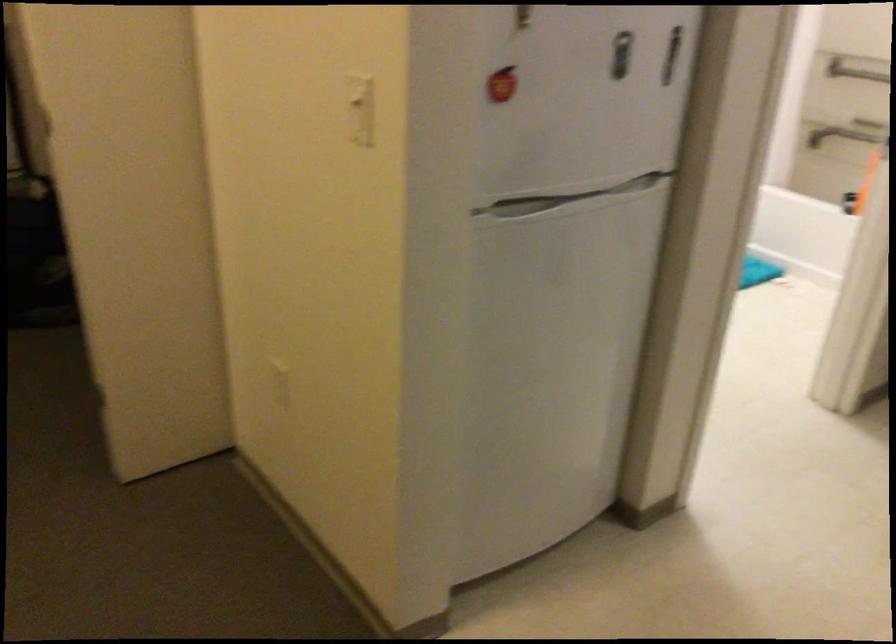
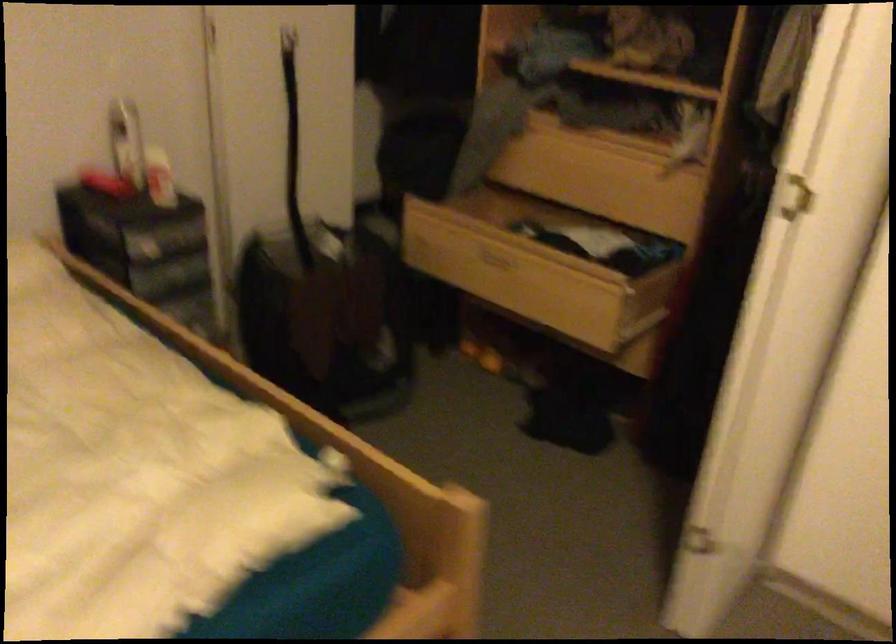
The images are taken continuously from a first-person perspective. In which direction are you moving?

The cameraman walked toward left, forward.